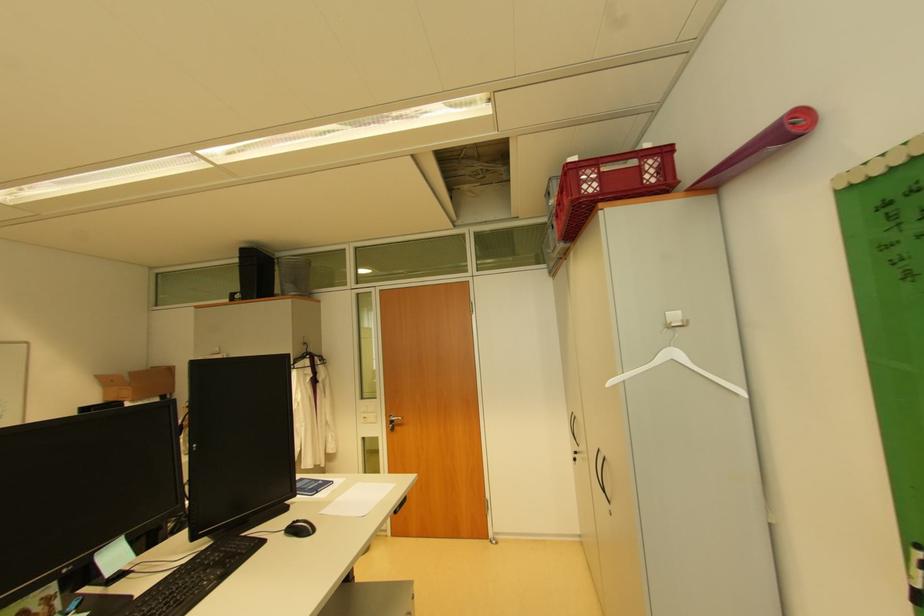
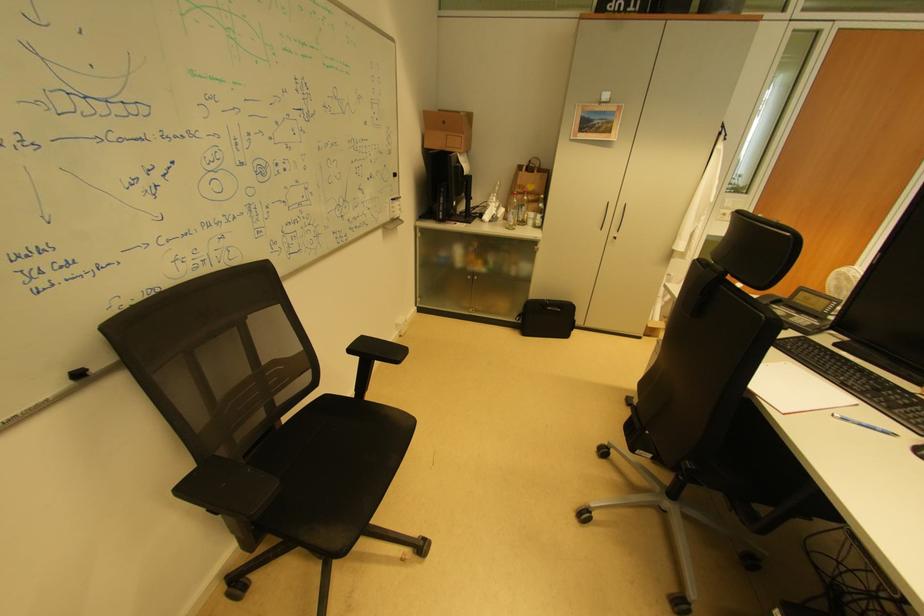
Where in the second image is the point corresponding to pixel 120 383 from the first image?

(453, 124)